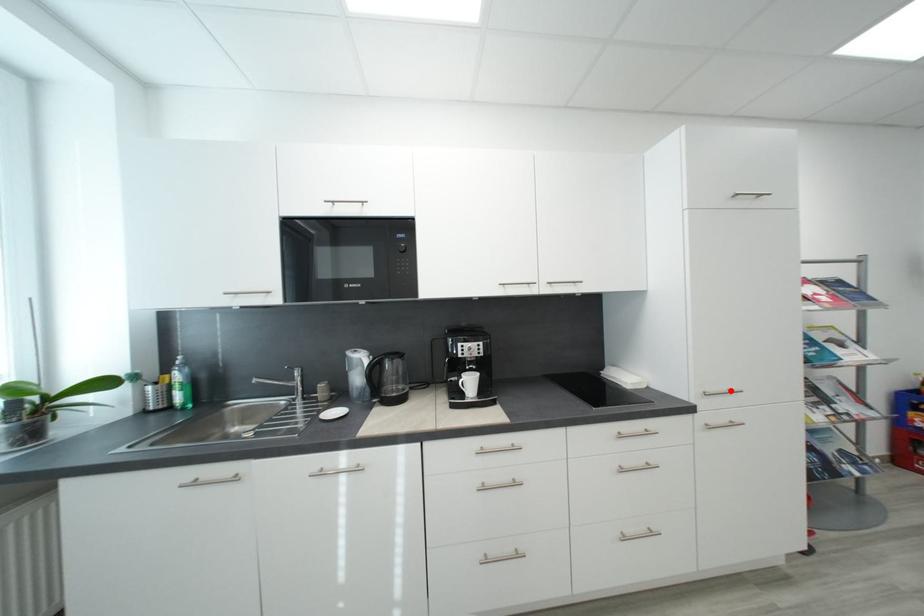
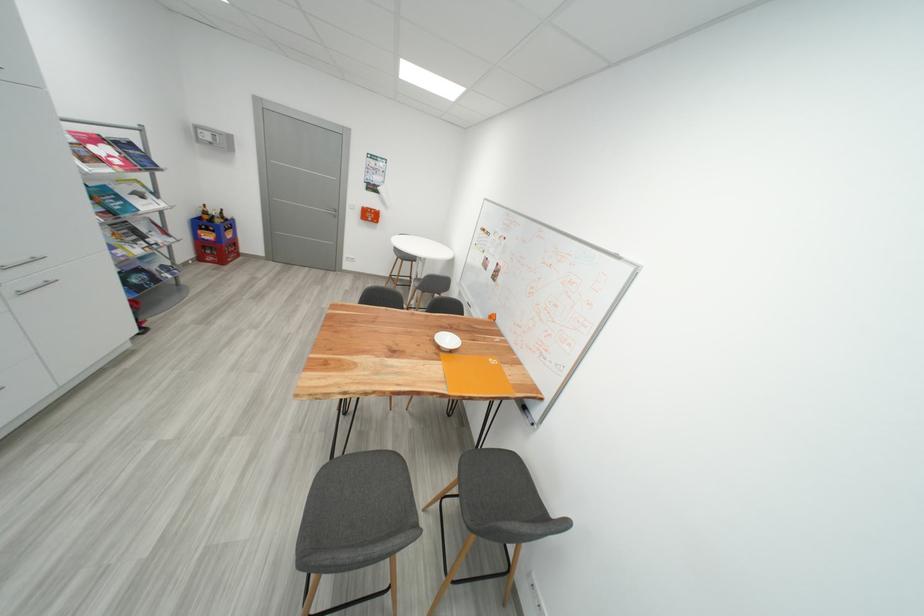
Where in the second image is the point corresponding to the highlighted location from the first image?

(32, 260)